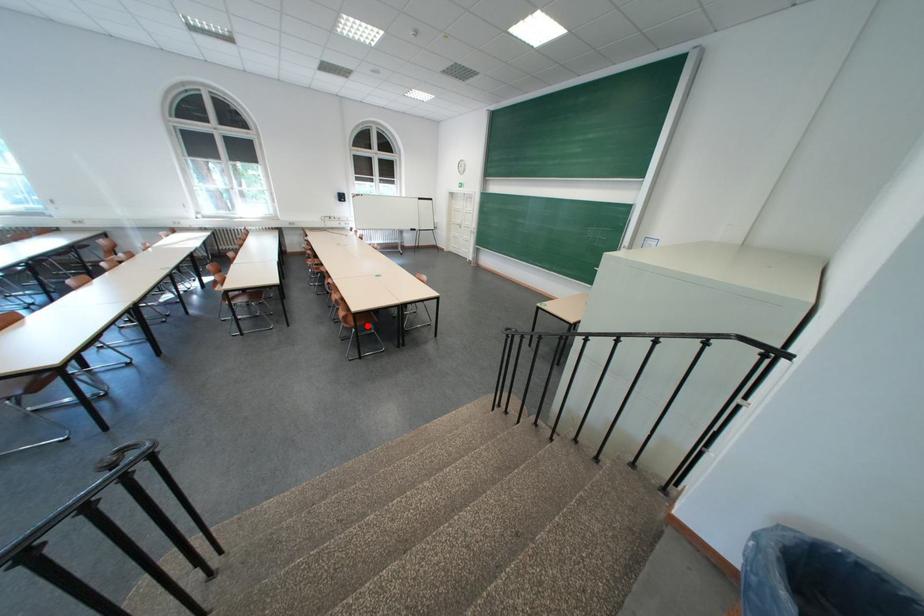
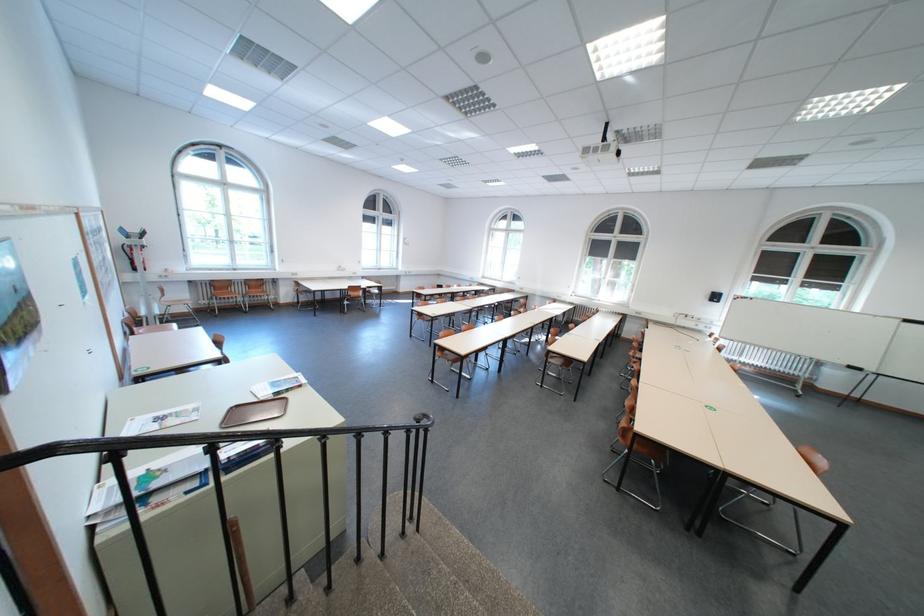
Question: I am providing you with two images of the same scene from different viewpoints. A red point is shown in image1. For the corresponding object point in image2, is it positioned nearer or farther from the camera?

Choices:
 (A) Nearer
 (B) Farther

Answer: (B)